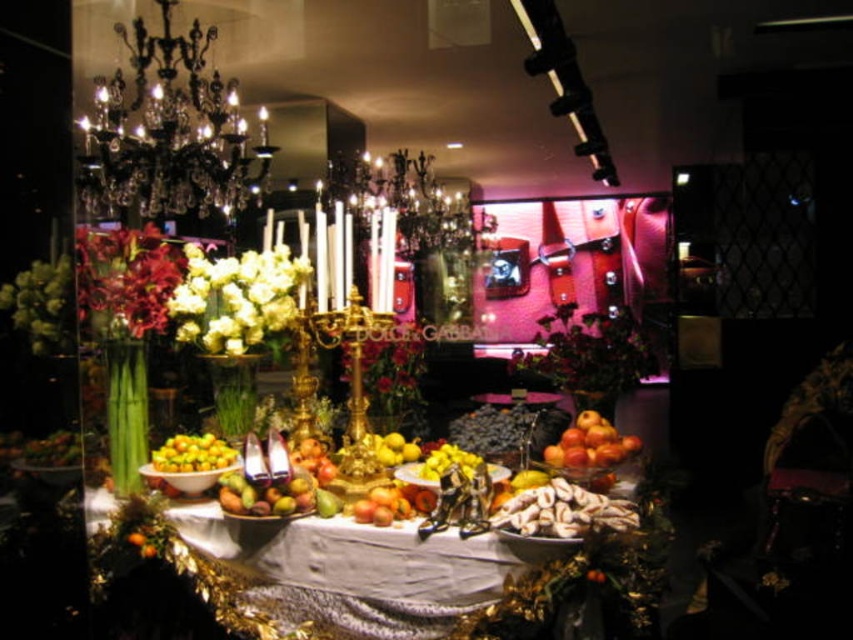
Between white matte flowers at center and yellow matte lemons at center, which one is positioned higher?

white matte flowers at center is above.

Is white matte flowers at center further to the viewer compared to yellow matte lemons at center?

Yes, it is.

Is point (288, 264) more distant than point (170, 467)?

Yes, point (288, 264) is farther from viewer.

The image size is (853, 640). I want to click on white matte flowers at center, so click(x=236, y=298).

Can you confirm if shiny red apples at center is positioned to the right of yellow matte lemons at center?

Correct, you'll find shiny red apples at center to the right of yellow matte lemons at center.

Is point (610, 440) positioned before point (199, 449)?

Yes, point (610, 440) is in front of point (199, 449).

Where is `shiny red apples at center`? shiny red apples at center is located at coordinates (590, 444).

Does yellow matte lemons at center have a larger size compared to yellow matte pear at center?

Incorrect, yellow matte lemons at center is not larger than yellow matte pear at center.

Is yellow matte lemons at center smaller than yellow matte pear at center?

Correct, yellow matte lemons at center occupies less space than yellow matte pear at center.

At what (x,y) coordinates should I click in order to perform the action: click on yellow matte lemons at center. Please return your answer as a coordinate pair (x, y). The width and height of the screenshot is (853, 640). Looking at the image, I should click on (192, 452).

Locate an element on the screen. This screenshot has height=640, width=853. yellow matte lemons at center is located at coordinates tap(192, 452).